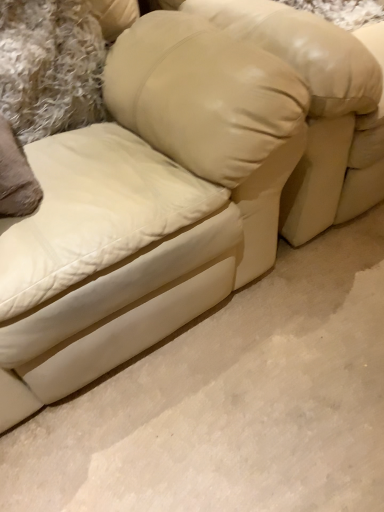
Question: Based on their sizes in the image, would you say beige leather pillow at upper center is bigger or smaller than beige leather bean bag chair at center?

Choices:
 (A) small
 (B) big

Answer: (A)

Question: From a real-world perspective, is beige leather pillow at upper center positioned above or below beige leather bean bag chair at center?

Choices:
 (A) below
 (B) above

Answer: (B)

Question: Considering the positions of beige leather pillow at upper center and beige leather bean bag chair at center in the image, is beige leather pillow at upper center wider or thinner than beige leather bean bag chair at center?

Choices:
 (A) wide
 (B) thin

Answer: (B)

Question: From a real-world perspective, is beige leather bean bag chair at center above or below beige leather pillow at upper center?

Choices:
 (A) below
 (B) above

Answer: (A)

Question: From the image's perspective, is beige leather bean bag chair at center positioned above or below beige leather pillow at upper center?

Choices:
 (A) below
 (B) above

Answer: (B)

Question: Considering their positions, is beige leather bean bag chair at center located in front of or behind beige leather pillow at upper center?

Choices:
 (A) behind
 (B) front

Answer: (B)

Question: In terms of width, does beige leather bean bag chair at center look wider or thinner when compared to beige leather pillow at upper center?

Choices:
 (A) thin
 (B) wide

Answer: (B)